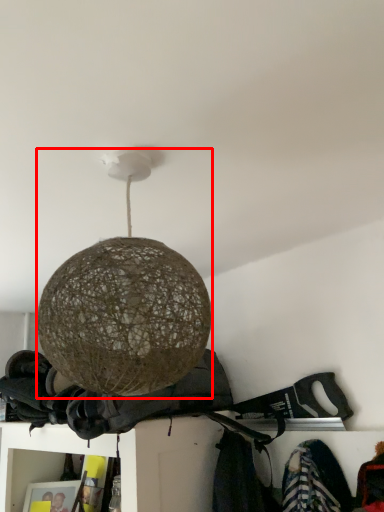
Question: From the image's perspective, what is the correct spatial relationship of lamp (annotated by the red box) in relation to clothing?

Choices:
 (A) above
 (B) below

Answer: (A)